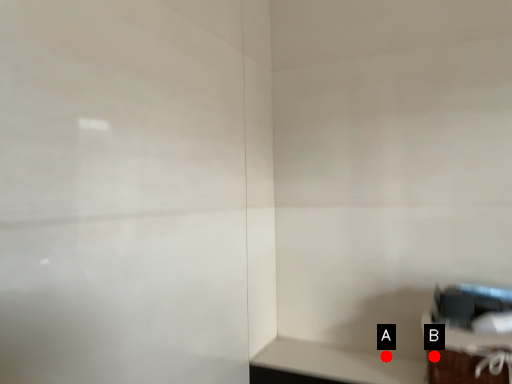
Question: Two points are circled on the image, labeled by A and B beside each circle. Which point is closer to the camera taking this photo?

Choices:
 (A) A is closer
 (B) B is closer

Answer: (B)